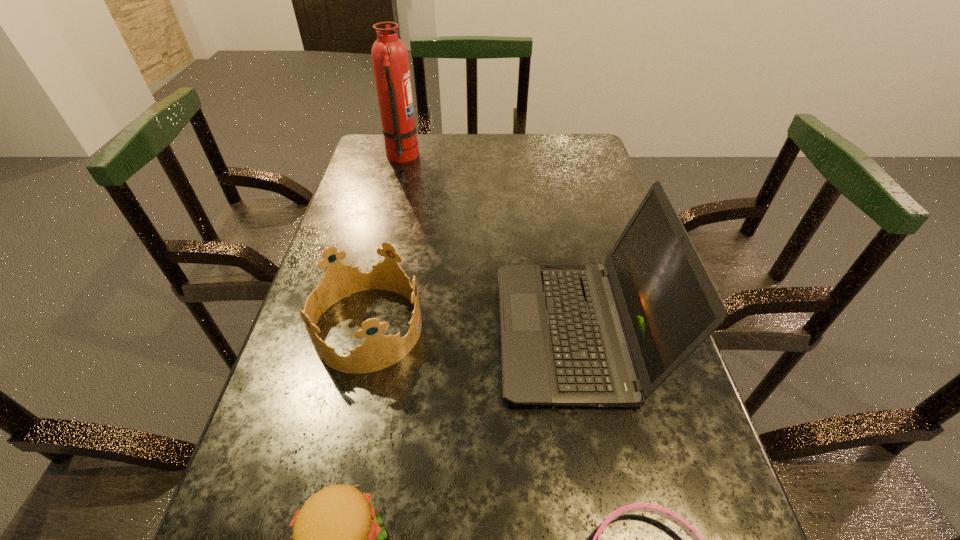
Where is `vacant area that lies between the laptop_computer and the farthest object`? The width and height of the screenshot is (960, 540). vacant area that lies between the laptop_computer and the farthest object is located at coordinates (488, 244).

Select which object is the fourth closest to the second tallest object. Please provide its 2D coordinates. Your answer should be formatted as a tuple, i.e. [(x, y)], where the tuple contains the x and y coordinates of a point satisfying the conditions above.

[(389, 55)]

Locate an element on the screen. object that stands as the second closest to the laptop_computer is located at coordinates (637, 507).